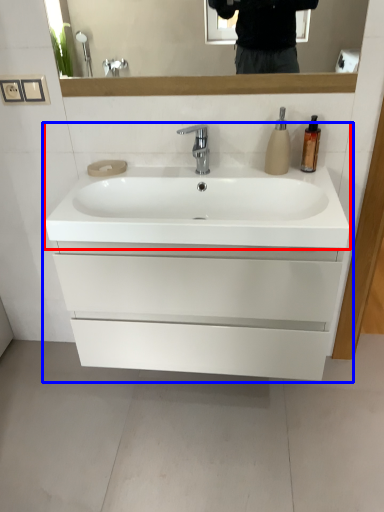
Question: Which object appears farthest to the camera in this image, sink (highlighted by a red box) or bathroom cabinet (highlighted by a blue box)?

Choices:
 (A) sink
 (B) bathroom cabinet

Answer: (B)